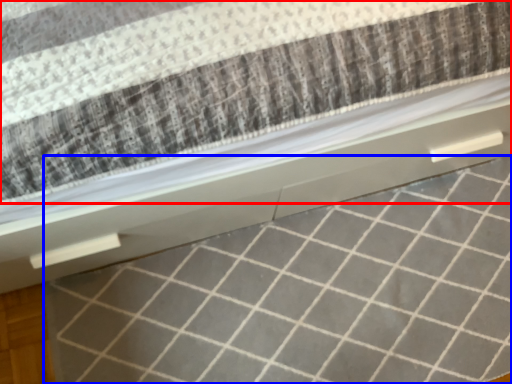
Question: Which object is closer to the camera taking this photo, mattress (highlighted by a red box) or tile (highlighted by a blue box)?

Choices:
 (A) mattress
 (B) tile

Answer: (A)